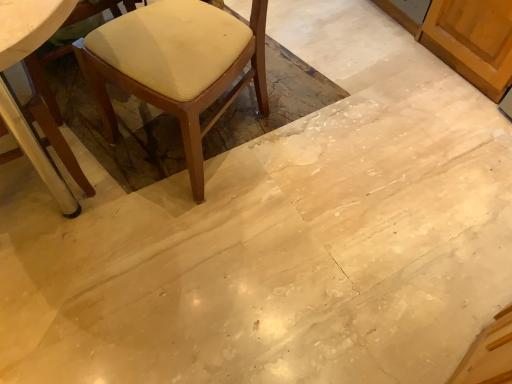
You are a GUI agent. You are given a task and a screenshot of the screen. Output one action in this format:
    pyautogui.click(x=<x>, y=<y>)
    Task: Click on the free spot in front of matte beige cushioned chair at left, arranged as the first chair when viewed from the right
    
    Given the screenshot: What is the action you would take?
    pyautogui.click(x=194, y=241)